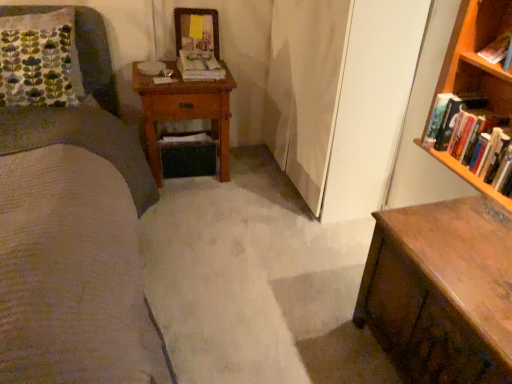
Question: Is point (455, 347) positioned closer to the camera than point (477, 52)?

Choices:
 (A) farther
 (B) closer

Answer: (B)

Question: Based on their sizes in the image, would you say wooden chest of drawers at lower right is bigger or smaller than hardcover book at upper right, arranged as the 2th book when viewed from the back?

Choices:
 (A) small
 (B) big

Answer: (B)

Question: Estimate the real-world distances between objects in this image. Which object is closer to the hardcover books at right, the 3th book viewed from the top?

Choices:
 (A) wooden nightstand at center
 (B) wooden picture frame at upper center
 (C) hardcover book at upper right, which ranks as the 2th book in top-to-bottom order
 (D) white paper book at center, acting as the 3th book starting from the front
 (E) wooden chest of drawers at lower right

Answer: (C)

Question: Which is farther from the hardcover books at right, the 3th book viewed from the top?

Choices:
 (A) white paper book at center, acting as the 3th book starting from the front
 (B) wooden chest of drawers at lower right
 (C) hardcover book at upper right, which ranks as the 2th book in top-to-bottom order
 (D) wooden nightstand at center
 (E) wooden picture frame at upper center

Answer: (E)